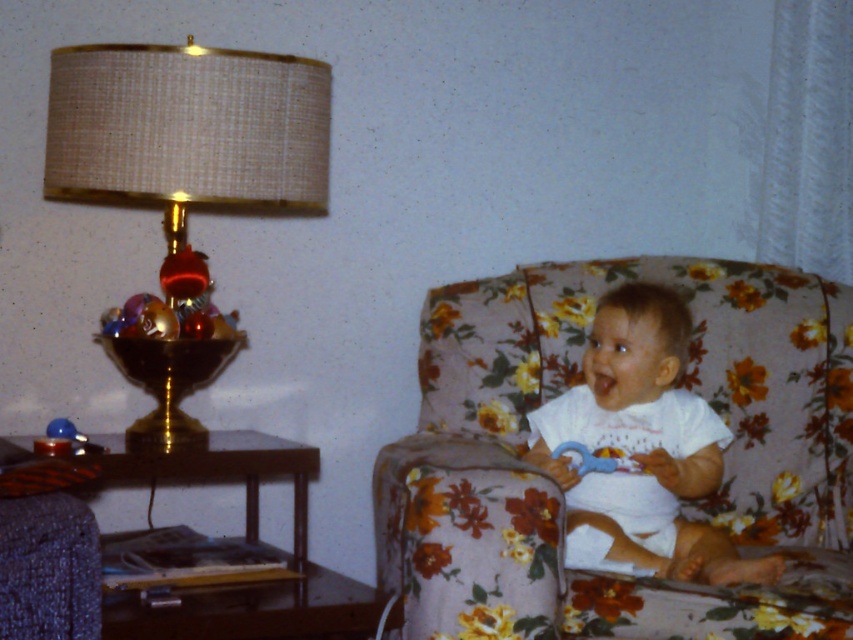
You are a photographer setting up for a baby photoshoot. You need to ensure the white cotton baby at center is the main focus. Given that the gold metallic lampshade at upper left is larger, how might you adjust the camera angle to minimize the lampshade in the frame?

Since the gold metallic lampshade at upper left is larger than the white cotton baby at center, you can lower the camera angle to position the baby at eye level while tilting slightly downward. This will reduce the prominence of the lampshade in the background, keeping the focus on the white cotton baby at center.

You are a guest entering the room and want to sit on the floral fabric couch at center. To reach it, you must walk around the gold metallic lampshade at upper left. Which direction should you move relative to the lampshade?

Since the floral fabric couch at center is to the right of the gold metallic lampshade at upper left, you should move to the right of the lampshade to reach the couch.